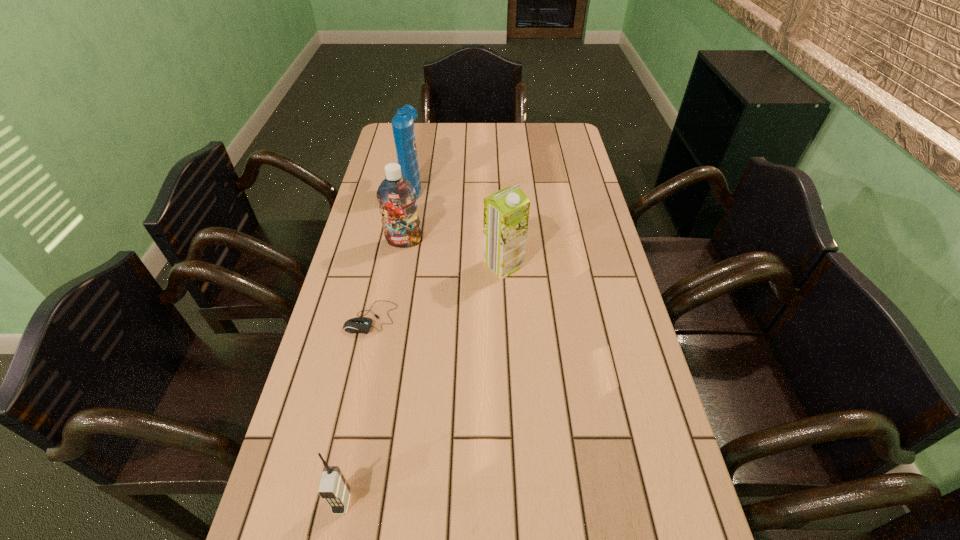
Find the location of a particular element. This screenshot has width=960, height=540. vacant space located on the front label of the nearer shampoo is located at coordinates (391, 314).

Locate an element on the screen. The image size is (960, 540). vacant space situated 0.350m on the front of the computer mouse is located at coordinates (333, 491).

Locate an element on the screen. cellular telephone that is at the left edge is located at coordinates (333, 487).

Locate an element on the screen. Image resolution: width=960 pixels, height=540 pixels. computer mouse located in the left edge section of the desktop is located at coordinates (362, 325).

In the image, there is a desktop. Find the location of `free space at the far edge`. free space at the far edge is located at coordinates (524, 139).

Where is `vacant region at the left edge`? This screenshot has width=960, height=540. vacant region at the left edge is located at coordinates (372, 370).

Where is `free space at the right edge`? This screenshot has width=960, height=540. free space at the right edge is located at coordinates click(x=605, y=501).

The image size is (960, 540). Find the location of `free space at the far left corner of the desktop`. free space at the far left corner of the desktop is located at coordinates (390, 149).

Find the location of a particular element. This screenshot has height=540, width=960. vacant space in between the fourth tallest object and the farthest object is located at coordinates (377, 345).

The width and height of the screenshot is (960, 540). In order to click on free spot between the fourth nearest object and the soya milk in this screenshot , I will do `click(454, 253)`.